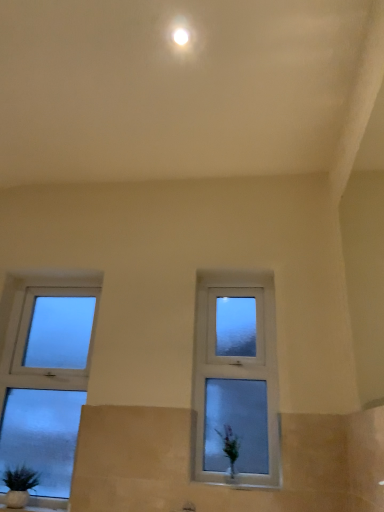
Question: From the image's perspective, is frosted glass window at left, which ranks as the 2th window in right-to-left order, above or below white glossy light at upper center?

Choices:
 (A) above
 (B) below

Answer: (B)

Question: Is point (34, 375) positioned closer to the camera than point (185, 30)?

Choices:
 (A) closer
 (B) farther

Answer: (B)

Question: Estimate the real-world distances between objects in this image. Which object is farther from the clear glass window at center, arranged as the second window when viewed from the left?

Choices:
 (A) frosted glass window at left, which ranks as the first window in left-to-right order
 (B) white glossy vase at lower center
 (C) green matte plant at lower left
 (D) white glossy light at upper center

Answer: (D)

Question: Estimate the real-world distances between objects in this image. Which object is farther from the frosted glass window at left, which ranks as the 2th window in right-to-left order?

Choices:
 (A) green matte plant at lower left
 (B) clear glass window at center, which appears as the first window when viewed from the right
 (C) white glossy light at upper center
 (D) white glossy vase at lower center

Answer: (C)